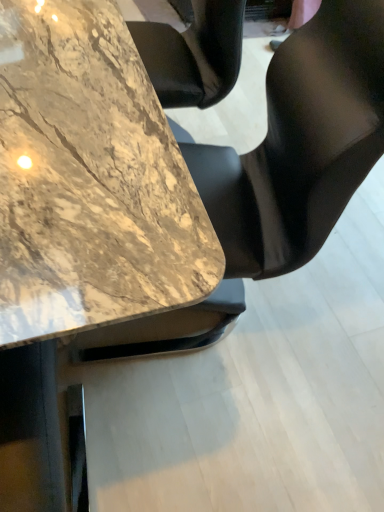
You are a GUI agent. You are given a task and a screenshot of the screen. Output one action in this format:
    pyautogui.click(x=<x>, y=<y>)
    Task: Click on the black leather chair at center
    
    Given the screenshot: What is the action you would take?
    click(x=300, y=144)

In order to face black leather chair at center, should I rotate leftwards or rightwards?

Turn right by 1.498 degrees to look at black leather chair at center.

The height and width of the screenshot is (512, 384). What do you see at coordinates (300, 144) in the screenshot?
I see `black leather chair at center` at bounding box center [300, 144].

The image size is (384, 512). What do you see at coordinates (90, 179) in the screenshot? I see `marble table at center` at bounding box center [90, 179].

Locate an element on the screen. The image size is (384, 512). marble table at center is located at coordinates (90, 179).

Where is `black leather chair at center`? This screenshot has height=512, width=384. black leather chair at center is located at coordinates (300, 144).

Considering the relative positions of black leather chair at center and marble table at center in the image provided, is black leather chair at center to the right of marble table at center from the viewer's perspective?

Indeed, black leather chair at center is positioned on the right side of marble table at center.

Relative to marble table at center, is black leather chair at center in front or behind?

Clearly, black leather chair at center is behind marble table at center.

Which is behind, point (367, 110) or point (77, 281)?

The point (367, 110) is more distant.

From the image's perspective, which one is positioned lower, black leather chair at center or marble table at center?

black leather chair at center is shown below in the image.

From a real-world perspective, which is physically below, black leather chair at center or marble table at center?

Answer: In real-world perspective, marble table at center is lower.

Looking at their sizes, would you say black leather chair at center is wider or thinner than marble table at center?

Clearly, black leather chair at center has less width compared to marble table at center.

Who is taller, black leather chair at center or marble table at center?

black leather chair at center.

Which of these two, black leather chair at center or marble table at center, is bigger?

With larger size is marble table at center.

Is black leather chair at center positioned beyond the bounds of marble table at center?

Yes, black leather chair at center is located beyond the bounds of marble table at center.

Is black leather chair at center placed right next to marble table at center?

No, black leather chair at center is not beside marble table at center.

Is marble table at center at the back of black leather chair at center?

No, black leather chair at center's orientation is not away from marble table at center.

Measure the distance between black leather chair at center and marble table at center.

A distance of 14.78 inches exists between black leather chair at center and marble table at center.

Locate an element on the screen. This screenshot has width=384, height=512. table below the black leather chair at center (from a real-world perspective) is located at coordinates (90, 179).

Which object is positioned more to the left, marble table at center or black leather chair at center?

Positioned to the left is marble table at center.

Which object is closer to the camera taking this photo, marble table at center or black leather chair at center?

marble table at center is in front.

Is point (80, 150) farther from camera compared to point (210, 215)?

That is False.

From the image's perspective, is marble table at center below black leather chair at center?

No, from the image's perspective, marble table at center is not below black leather chair at center.

From the picture: From a real-world perspective, is marble table at center physically above black leather chair at center?

No.

Does marble table at center have a lesser width compared to black leather chair at center?

No, marble table at center is not thinner than black leather chair at center.

Based on the photo, considering the sizes of marble table at center and black leather chair at center in the image, is marble table at center taller or shorter than black leather chair at center?

Clearly, marble table at center is shorter compared to black leather chair at center.

Is marble table at center bigger or smaller than black leather chair at center?

Considering their sizes, marble table at center takes up more space than black leather chair at center.

Is marble table at center spatially inside black leather chair at center, or outside of it?

marble table at center is not inside black leather chair at center, it's outside.

Is marble table at center placed right next to black leather chair at center?

No.

Does marble table at center turn towards black leather chair at center?

Yes, marble table at center is turned towards black leather chair at center.

At what (x,y) coordinates should I click in order to perform the action: click on table that appears below the black leather chair at center (from a real-world perspective). Please return your answer as a coordinate pair (x, y). Image resolution: width=384 pixels, height=512 pixels. Looking at the image, I should click on (90, 179).

Locate an element on the screen. The width and height of the screenshot is (384, 512). table to the left of black leather chair at center is located at coordinates (90, 179).

The width and height of the screenshot is (384, 512). What are the coordinates of `table in front of the black leather chair at center` in the screenshot? It's located at [90, 179].